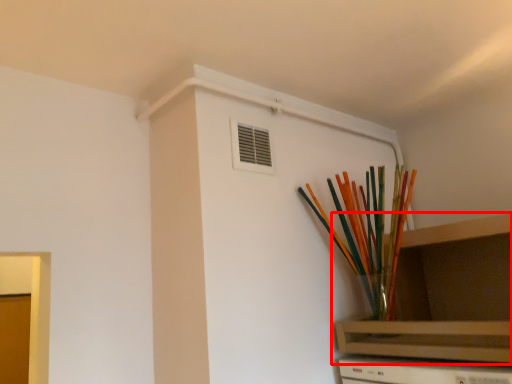
Question: From the image's perspective, what is the correct spatial relationship of shelf (annotated by the red box) in relation to paint brush?

Choices:
 (A) above
 (B) below

Answer: (B)